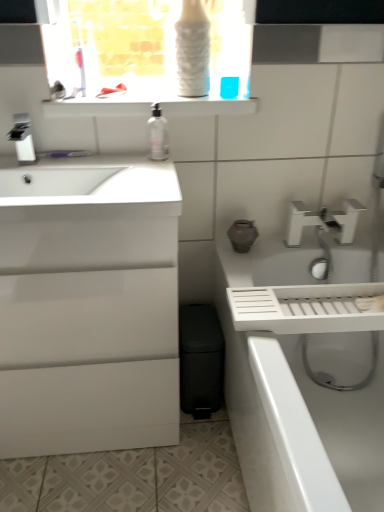
Locate an element on the screen. The width and height of the screenshot is (384, 512). free space to the left of clear plastic bottle at center is located at coordinates (112, 159).